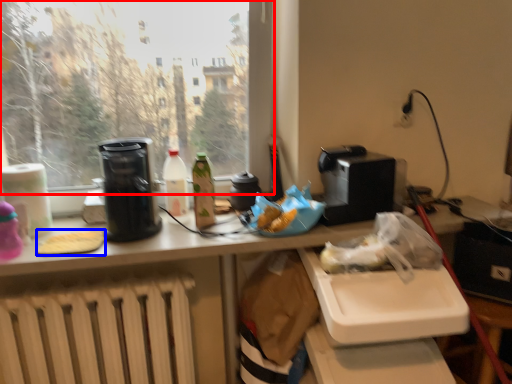
Question: Which of the following is the farthest to the observer, window (highlighted by a red box) or food (highlighted by a blue box)?

Choices:
 (A) window
 (B) food

Answer: (B)